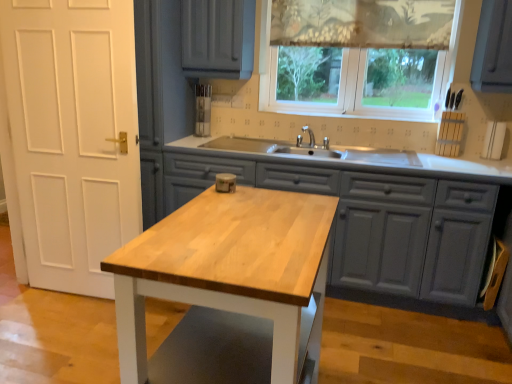
Question: Considering the positions of wooden island at center and patterned fabric curtain at upper center in the image, is wooden island at center wider or thinner than patterned fabric curtain at upper center?

Choices:
 (A) wide
 (B) thin

Answer: (A)

Question: Is point (455, 216) positioned closer to the camera than point (415, 9)?

Choices:
 (A) farther
 (B) closer

Answer: (B)

Question: Estimate the real-world distances between objects in this image. Which object is closer to the light wood table at center?

Choices:
 (A) patterned fabric curtain at upper center
 (B) translucent fabric at upper center
 (C) wooden island at center

Answer: (C)

Question: Which is nearer to the translucent fabric at upper center?

Choices:
 (A) patterned fabric curtain at upper center
 (B) light wood table at center
 (C) wooden island at center

Answer: (A)